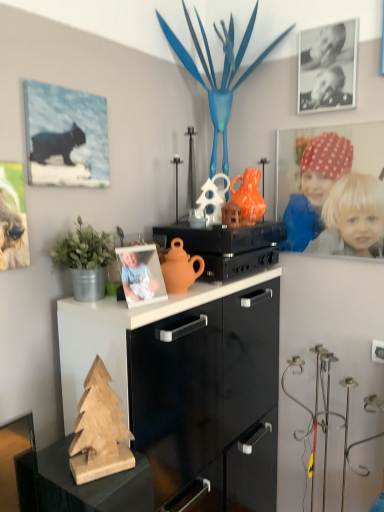
Question: From the image's perspective, relative to matte black stereo at center, is green matte plant at left above or below?

Choices:
 (A) above
 (B) below

Answer: (B)

Question: In the image, is green matte plant at left positioned in front of or behind matte black stereo at center?

Choices:
 (A) front
 (B) behind

Answer: (A)

Question: Estimate the real-world distances between objects in this image. Which object is closer to the matte canvas print of cat at upper left, marked as the 1th picture frame in a bottom-to-top arrangement?

Choices:
 (A) polka dot fabric headscarf at upper right
 (B) matte black stereo at center
 (C) green matte plant at left
 (D) black matte photo frame at upper right, the 1th picture frame when ordered from right to left
 (E) wooden christmas tree at lower left

Answer: (C)

Question: Which object is positioned farthest from the black matte photo frame at upper right, the 1th picture frame viewed from the back?

Choices:
 (A) green matte plant at left
 (B) matte canvas print of cat at upper left, which is the first picture frame in front-to-back order
 (C) matte orange teapot at center
 (D) matte black stereo at center
 (E) polka dot fabric headscarf at upper right

Answer: (A)